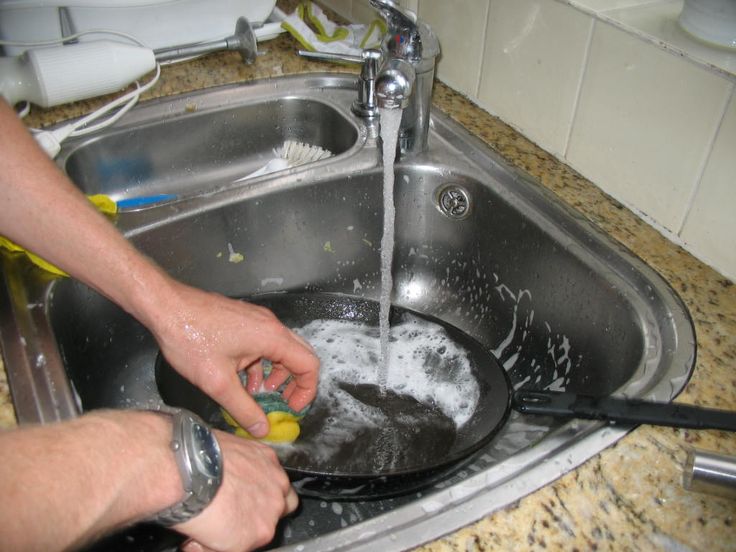
This screenshot has width=736, height=552. Find the location of `faucet`. faucet is located at coordinates (400, 70).